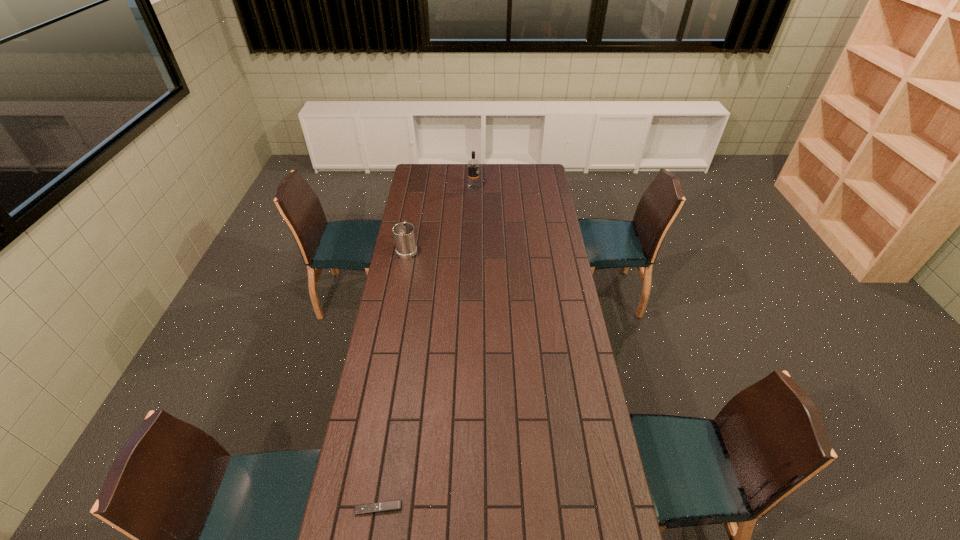
The width and height of the screenshot is (960, 540). In order to click on free space located on the back of the shortest object in this screenshot , I will do `click(391, 430)`.

The width and height of the screenshot is (960, 540). Find the location of `object located at the far edge`. object located at the far edge is located at coordinates (473, 165).

The image size is (960, 540). I want to click on mug situated at the left edge, so click(404, 236).

The image size is (960, 540). What are the coordinates of `remote control positioned at the left edge` in the screenshot? It's located at (387, 506).

The height and width of the screenshot is (540, 960). What are the coordinates of `vacant region at the left edge of the desktop` in the screenshot? It's located at (420, 188).

Where is `vacant space at the right edge of the desktop`? vacant space at the right edge of the desktop is located at coordinates (559, 285).

Find the location of `free space between the farthest object and the second farthest object`. free space between the farthest object and the second farthest object is located at coordinates (441, 219).

At what (x,y) coordinates should I click in order to perform the action: click on vacant point located between the second farthest object and the nearest object. Please return your answer as a coordinate pair (x, y). The image size is (960, 540). Looking at the image, I should click on (393, 379).

You are a GUI agent. You are given a task and a screenshot of the screen. Output one action in this format:
    pyautogui.click(x=<x>, y=<y>)
    Task: Click on the empty space between the tallest object and the remote control
    This screenshot has width=960, height=540.
    Given the screenshot: What is the action you would take?
    pyautogui.click(x=426, y=348)

Locate an element on the screen. This screenshot has width=960, height=540. free space between the mug and the nearest object is located at coordinates (393, 379).